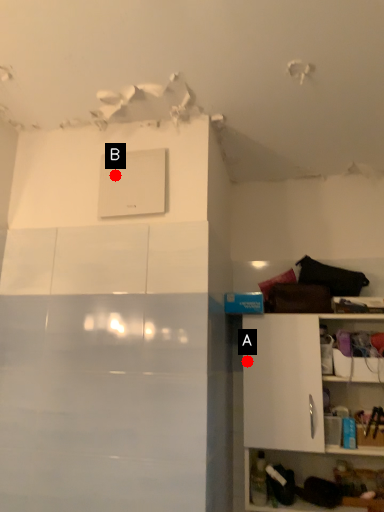
Question: Two points are circled on the image, labeled by A and B beside each circle. Which point appears closest to the camera in this image?

Choices:
 (A) A is closer
 (B) B is closer

Answer: (B)